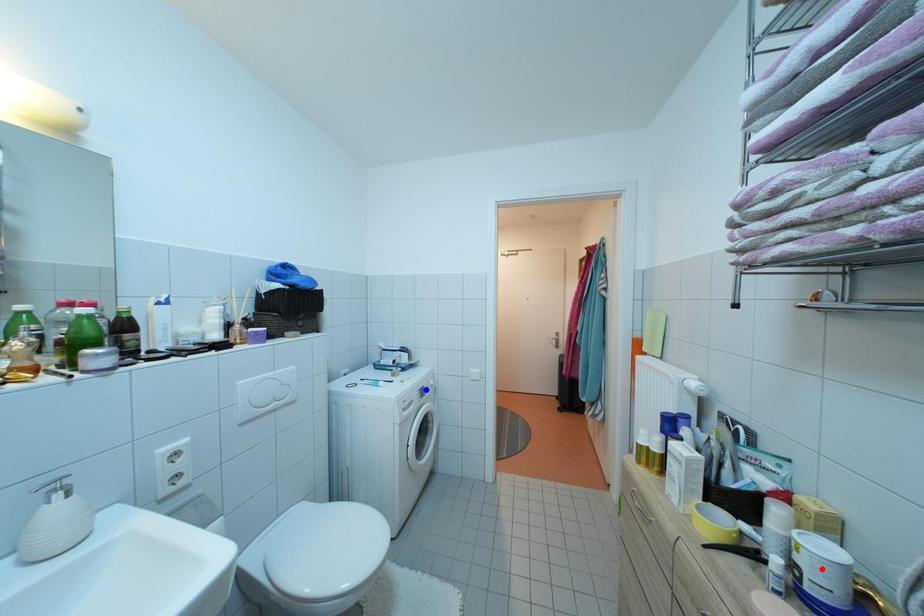
Question: Which of the two points in the image is closer to the camera?

Choices:
 (A) Blue point is closer.
 (B) Red point is closer.

Answer: (B)